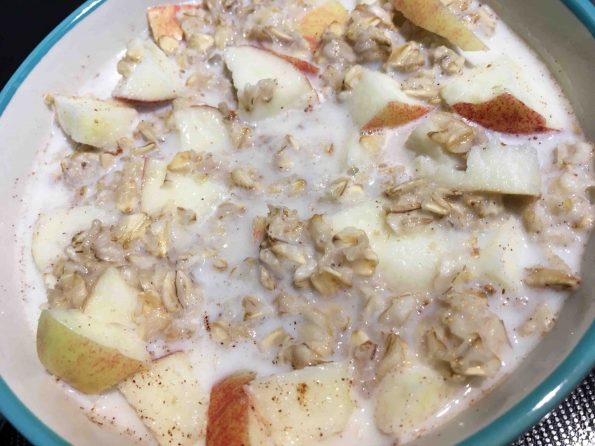
Locate an element on the screen. This screenshot has height=446, width=595. table is located at coordinates point(569,426).